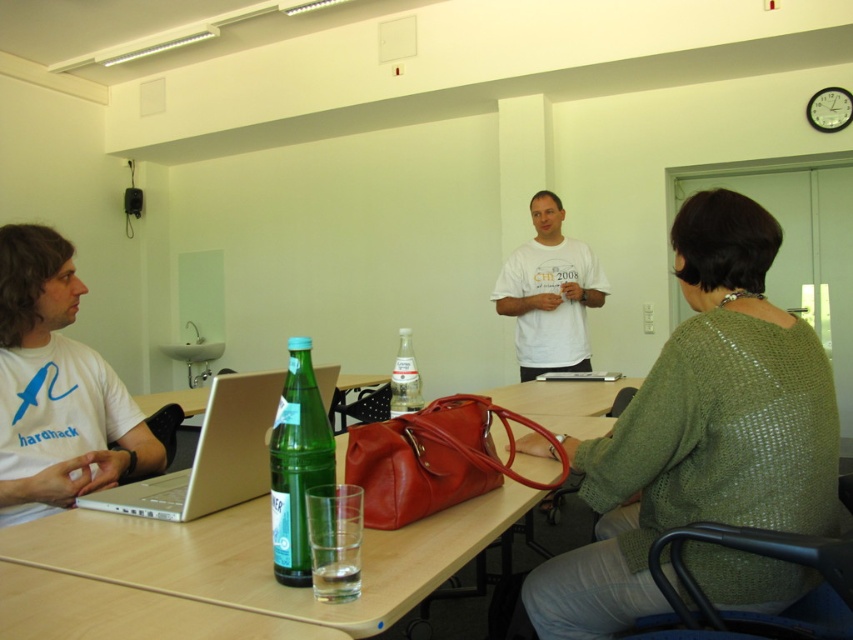
In the scene shown: Is green knitted sweater at center to the left of white matte t-shirt at left from the viewer's perspective?

Incorrect, green knitted sweater at center is not on the left side of white matte t-shirt at left.

Is green knitted sweater at center shorter than white matte t-shirt at left?

In fact, green knitted sweater at center may be taller than white matte t-shirt at left.

Between point (627, 584) and point (48, 502), which one is positioned in front?

Positioned in front is point (627, 584).

The image size is (853, 640). I want to click on green knitted sweater at center, so click(701, 429).

Does green knitted sweater at center have a greater height compared to clear glass bottle at center?

Yes.

What do you see at coordinates (701, 429) in the screenshot? The height and width of the screenshot is (640, 853). I see `green knitted sweater at center` at bounding box center [701, 429].

Where is `green knitted sweater at center`? This screenshot has height=640, width=853. green knitted sweater at center is located at coordinates (701, 429).

Where is `silver metallic laptop at left`? Image resolution: width=853 pixels, height=640 pixels. silver metallic laptop at left is located at coordinates [x=210, y=456].

Between point (254, 484) and point (280, 472), which one is positioned behind?

Point (254, 484)

At what (x,y) coordinates should I click in order to perform the action: click on silver metallic laptop at left. Please return your answer as a coordinate pair (x, y). The image size is (853, 640). Looking at the image, I should click on (210, 456).